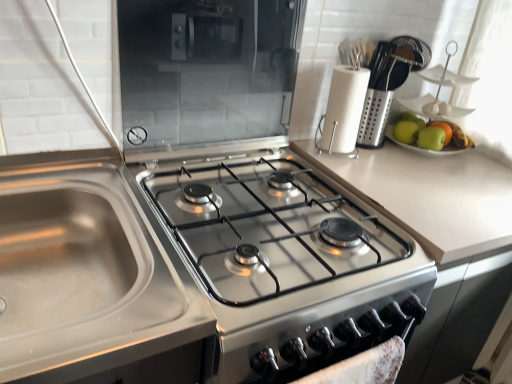
At what (x,y) coordinates should I click in order to perform the action: click on free space to the left of green matte apple at right, which is the 3th apple in left-to-right order. Please return your answer as a coordinate pair (x, y). Looking at the image, I should click on (393, 149).